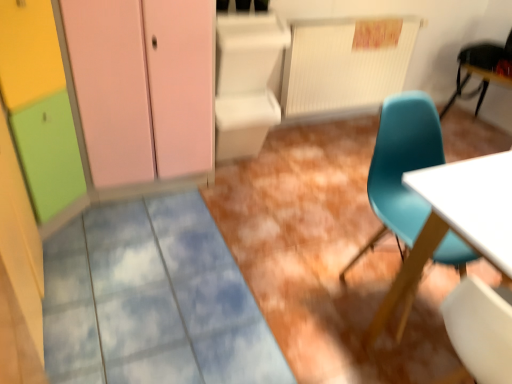
At what (x,y) coordinates should I click in order to perform the action: click on matte pink cabinet at upper left. Please return your answer as a coordinate pair (x, y). Looking at the image, I should click on (143, 86).

Image resolution: width=512 pixels, height=384 pixels. What do you see at coordinates (143, 86) in the screenshot?
I see `matte pink cabinet at upper left` at bounding box center [143, 86].

The width and height of the screenshot is (512, 384). I want to click on matte plastic chair at right, the first chair viewed from the left, so click(x=402, y=167).

From the image's perspective, which is below, matte pink cabinet at upper left or matte plastic chair at right, the first chair viewed from the left?

matte plastic chair at right, the first chair viewed from the left, appears lower in the image.

Which point is more forward, [197,39] or [402,196]?

The point [402,196] is in front.

Is matte pink cabinet at upper left oriented away from matte plastic chair at right, the 2th chair in the top-to-bottom sequence?

matte pink cabinet at upper left is not turned away from matte plastic chair at right, the 2th chair in the top-to-bottom sequence.

Looking at this image, from a real-world perspective, between matte pink cabinet at upper left and matte plastic chair at right, the first chair viewed from the left, who is vertically lower?

matte plastic chair at right, the first chair viewed from the left.

Is matte plastic chair at right, the first chair from the front, bigger or smaller than teal plastic chair at upper right, which appears as the 2th chair when viewed from the left?

Considering their sizes, matte plastic chair at right, the first chair from the front, takes up more space than teal plastic chair at upper right, which appears as the 2th chair when viewed from the left.

Is matte plastic chair at right, arranged as the 1th chair when ordered from the bottom, closer to the viewer compared to teal plastic chair at upper right, which is the first chair from right to left?

Yes, it is.

In the scene shown: From a real-world perspective, is teal plastic chair at upper right, which is the first chair from right to left, physically located above or below matte plastic chair at right, marked as the second chair in a right-to-left arrangement?

From a real-world perspective, teal plastic chair at upper right, which is the first chair from right to left, is physically above matte plastic chair at right, marked as the second chair in a right-to-left arrangement.

Is teal plastic chair at upper right, arranged as the 2th chair when ordered from the bottom, completely or partially outside of matte plastic chair at right, arranged as the 1th chair when ordered from the bottom?

That's correct, teal plastic chair at upper right, arranged as the 2th chair when ordered from the bottom, is outside of matte plastic chair at right, arranged as the 1th chair when ordered from the bottom.

The image size is (512, 384). Find the location of `chair in front of the teal plastic chair at upper right, which appears as the 2th chair when viewed from the left`. chair in front of the teal plastic chair at upper right, which appears as the 2th chair when viewed from the left is located at coordinates (402, 167).

Considering the sizes of objects teal plastic chair at upper right, which appears as the 2th chair when viewed from the left, and matte pink cabinet at upper left in the image provided, who is taller, teal plastic chair at upper right, which appears as the 2th chair when viewed from the left, or matte pink cabinet at upper left?

matte pink cabinet at upper left is taller.

Is point (485, 93) positioned in front of point (158, 141)?

No, it is behind (158, 141).

Which object is closer to the camera, teal plastic chair at upper right, the 1th chair viewed from the top, or matte pink cabinet at upper left?

matte pink cabinet at upper left is more forward.

Between teal plastic chair at upper right, which appears as the 2th chair when viewed from the left, and matte pink cabinet at upper left, which one has larger size?

matte pink cabinet at upper left is bigger.

Choose the correct answer: Is matte plastic chair at right, which is the second chair from back to front, inside matte pink cabinet at upper left or outside it?

matte plastic chair at right, which is the second chair from back to front, is not inside matte pink cabinet at upper left, it's outside.

From the image's perspective, is matte plastic chair at right, the first chair viewed from the left, below matte pink cabinet at upper left?

Yes, from the image's perspective, matte plastic chair at right, the first chair viewed from the left, is beneath matte pink cabinet at upper left.

What's the angular difference between matte plastic chair at right, the first chair viewed from the left, and matte pink cabinet at upper left's facing directions?

They differ by 0.12 degrees in their facing directions.

Does matte plastic chair at right, marked as the second chair in a right-to-left arrangement, appear on the left side of matte pink cabinet at upper left?

In fact, matte plastic chair at right, marked as the second chair in a right-to-left arrangement, is to the right of matte pink cabinet at upper left.

Is matte pink cabinet at upper left inside or outside of teal plastic chair at upper right, the 1th chair viewed from the top?

matte pink cabinet at upper left exists outside the volume of teal plastic chair at upper right, the 1th chair viewed from the top.

In terms of size, does matte pink cabinet at upper left appear bigger or smaller than teal plastic chair at upper right, the 1th chair viewed from the top?

In the image, matte pink cabinet at upper left appears to be larger than teal plastic chair at upper right, the 1th chair viewed from the top.

This screenshot has height=384, width=512. I want to click on dresser that appears on the left of teal plastic chair at upper right, the 2th chair positioned from the front, so click(143, 86).

Considering the positions of point (173, 66) and point (458, 90), is point (173, 66) closer or farther from the camera than point (458, 90)?

Point (173, 66) appears to be closer to the viewer than point (458, 90).

You are a GUI agent. You are given a task and a screenshot of the screen. Output one action in this format:
    pyautogui.click(x=<x>, y=<y>)
    Task: Click on the chair below the matte pink cabinet at upper left (from the image's perspective)
    The width and height of the screenshot is (512, 384).
    Given the screenshot: What is the action you would take?
    pyautogui.click(x=402, y=167)

Identify the location of chair lying on the left of teal plastic chair at upper right, which appears as the 2th chair when viewed from the left. (402, 167).

Which object lies further to the anchor point matte plastic chair at right, the first chair from the front, teal plastic chair at upper right, which appears as the 2th chair when viewed from the left, or matte pink cabinet at upper left?

teal plastic chair at upper right, which appears as the 2th chair when viewed from the left, is further to matte plastic chair at right, the first chair from the front.

Looking at the image, which one is located closer to matte pink cabinet at upper left, matte plastic chair at right, the first chair viewed from the left, or teal plastic chair at upper right, which appears as the 2th chair when viewed from the left?

matte plastic chair at right, the first chair viewed from the left, is closer to matte pink cabinet at upper left.

Looking at the image, which one is located closer to teal plastic chair at upper right, which appears as the 2th chair when viewed from the left, matte pink cabinet at upper left or matte plastic chair at right, the first chair from the front?

The object closer to teal plastic chair at upper right, which appears as the 2th chair when viewed from the left, is matte plastic chair at right, the first chair from the front.

When comparing their distances from matte plastic chair at right, marked as the second chair in a right-to-left arrangement, does matte pink cabinet at upper left or teal plastic chair at upper right, the 1th chair viewed from the top, seem further?

teal plastic chair at upper right, the 1th chair viewed from the top, lies further to matte plastic chair at right, marked as the second chair in a right-to-left arrangement, than the other object.

Considering their positions, is matte plastic chair at right, the first chair from the front, positioned further to teal plastic chair at upper right, arranged as the 2th chair when ordered from the bottom, than matte pink cabinet at upper left?

matte pink cabinet at upper left lies further to teal plastic chair at upper right, arranged as the 2th chair when ordered from the bottom, than the other object.

Estimate the real-world distances between objects in this image. Which object is closer to matte pink cabinet at upper left, teal plastic chair at upper right, which ranks as the first chair in back-to-front order, or matte plastic chair at right, marked as the second chair in a right-to-left arrangement?

The object closer to matte pink cabinet at upper left is matte plastic chair at right, marked as the second chair in a right-to-left arrangement.

You are a GUI agent. You are given a task and a screenshot of the screen. Output one action in this format:
    pyautogui.click(x=<x>, y=<y>)
    Task: Click on the chair situated between matte pink cabinet at upper left and teal plastic chair at upper right, the 1th chair viewed from the top, from left to right
    This screenshot has height=384, width=512.
    Given the screenshot: What is the action you would take?
    pyautogui.click(x=402, y=167)